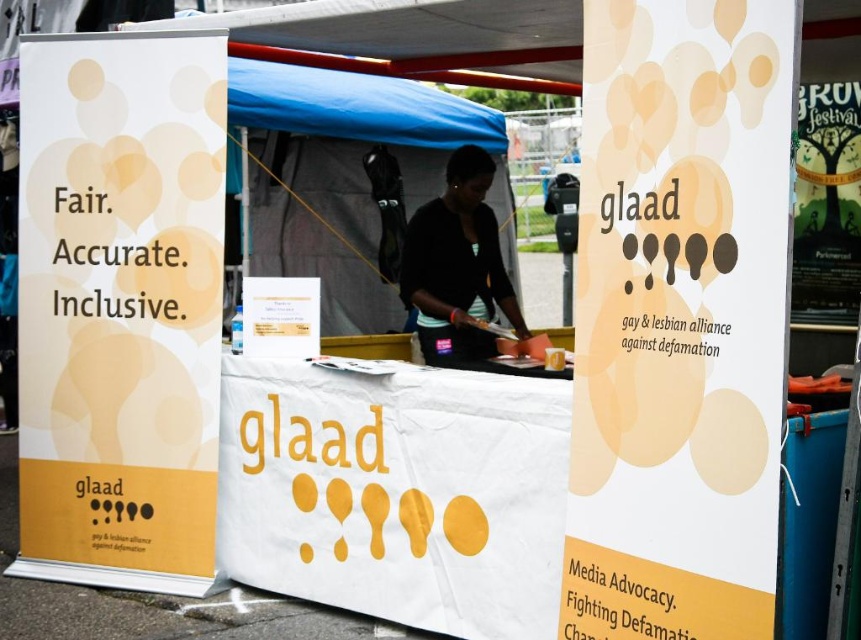
You are a person who wants to take a photo of the GLAAD booth from the front. Considering the blue fabric tent at center and the black matte shirt at center, which object would likely block your view of the GLAAD logo on the banners?

The blue fabric tent at center is much taller than the black matte shirt at center, so it would likely block your view of the GLAAD logo on the banners.

You are a visitor at a fair and want to approach the GLAAD booth. You see the blue fabric tent at center and the black matte shirt at center. Which object is larger in size?

The blue fabric tent at center is bigger than the black matte shirt at center.

You are a visitor approaching the GLAAD booth. You see the blue fabric tent at center and the black matte shirt at center. Which object is closer to you as you approach the booth?

The blue fabric tent at center is closer to you than the black matte shirt at center as you approach the booth.